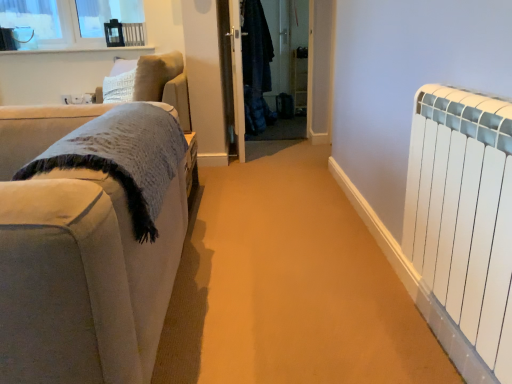
Question: Which direction should I rotate to look at denim jacket at center, positioned as the second screen door in left-to-right order, — up or down?

Choices:
 (A) down
 (B) up

Answer: (B)

Question: Considering the relative positions of denim jacket at center, which ranks as the first screen door in right-to-left order, and transparent glass door at center, the 2th screen door from the right, in the image provided, is denim jacket at center, which ranks as the first screen door in right-to-left order, to the right of transparent glass door at center, the 2th screen door from the right, from the viewer's perspective?

Choices:
 (A) no
 (B) yes

Answer: (B)

Question: Is denim jacket at center, which ranks as the first screen door in right-to-left order, directly adjacent to transparent glass door at center, the 2th screen door from the right?

Choices:
 (A) yes
 (B) no

Answer: (B)

Question: Is there a large distance between denim jacket at center, which ranks as the first screen door in right-to-left order, and transparent glass door at center, the first screen door positioned from the left?

Choices:
 (A) yes
 (B) no

Answer: (B)

Question: Is denim jacket at center, which ranks as the first screen door in right-to-left order, bigger than transparent glass door at center, the first screen door positioned from the left?

Choices:
 (A) no
 (B) yes

Answer: (B)

Question: Does denim jacket at center, positioned as the second screen door in left-to-right order, have a smaller size compared to transparent glass door at center, the 2th screen door from the right?

Choices:
 (A) yes
 (B) no

Answer: (B)

Question: Is denim jacket at center, which ranks as the first screen door in right-to-left order, facing away from transparent glass door at center, the 2th screen door from the right?

Choices:
 (A) yes
 (B) no

Answer: (B)

Question: From the image's perspective, would you say denim jacket at center, positioned as the second screen door in left-to-right order, is positioned over white glossy window sill at upper left?

Choices:
 (A) no
 (B) yes

Answer: (A)

Question: Is the position of denim jacket at center, which ranks as the first screen door in right-to-left order, less distant than that of white glossy window sill at upper left?

Choices:
 (A) yes
 (B) no

Answer: (A)

Question: Can you confirm if denim jacket at center, which ranks as the first screen door in right-to-left order, is smaller than white glossy window sill at upper left?

Choices:
 (A) no
 (B) yes

Answer: (A)

Question: Considering the relative sizes of denim jacket at center, which ranks as the first screen door in right-to-left order, and white glossy window sill at upper left in the image provided, is denim jacket at center, which ranks as the first screen door in right-to-left order, shorter than white glossy window sill at upper left?

Choices:
 (A) yes
 (B) no

Answer: (B)

Question: Is denim jacket at center, which ranks as the first screen door in right-to-left order, at the left side of white glossy window sill at upper left?

Choices:
 (A) no
 (B) yes

Answer: (A)

Question: Is denim jacket at center, which ranks as the first screen door in right-to-left order, oriented away from white glossy window sill at upper left?

Choices:
 (A) yes
 (B) no

Answer: (B)

Question: Is white glossy window sill at upper left located within white matte radiator at right?

Choices:
 (A) yes
 (B) no

Answer: (B)